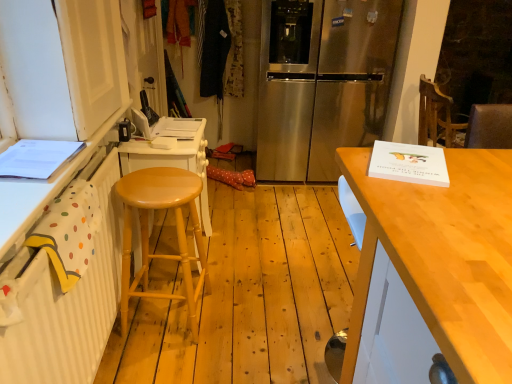
Question: Does light wood stool at left turn towards white painted wood cabinet at left?

Choices:
 (A) yes
 (B) no

Answer: (B)

Question: Would you say white painted wood cabinet at left is part of light wood stool at left's contents?

Choices:
 (A) yes
 (B) no

Answer: (B)

Question: Does light wood stool at left have a lesser height compared to white painted wood cabinet at left?

Choices:
 (A) no
 (B) yes

Answer: (A)

Question: Is the position of light wood stool at left less distant than that of white painted wood cabinet at left?

Choices:
 (A) no
 (B) yes

Answer: (A)

Question: Does light wood stool at left have a greater height compared to white painted wood cabinet at left?

Choices:
 (A) yes
 (B) no

Answer: (A)

Question: Is light wood stool at left bigger than white painted wood cabinet at left?

Choices:
 (A) yes
 (B) no

Answer: (A)

Question: Does light wood table at right contain stainless steel refrigerator at center?

Choices:
 (A) yes
 (B) no

Answer: (B)

Question: Considering the relative sizes of light wood table at right and stainless steel refrigerator at center in the image provided, is light wood table at right taller than stainless steel refrigerator at center?

Choices:
 (A) no
 (B) yes

Answer: (A)

Question: Is light wood table at right at the right side of stainless steel refrigerator at center?

Choices:
 (A) no
 (B) yes

Answer: (B)

Question: From the image's perspective, is light wood table at right beneath stainless steel refrigerator at center?

Choices:
 (A) no
 (B) yes

Answer: (B)

Question: Can you confirm if light wood table at right is shorter than stainless steel refrigerator at center?

Choices:
 (A) yes
 (B) no

Answer: (A)

Question: Is the depth of light wood table at right less than that of stainless steel refrigerator at center?

Choices:
 (A) no
 (B) yes

Answer: (B)

Question: Are stainless steel refrigerator at center and white painted wood cabinet at left beside each other?

Choices:
 (A) no
 (B) yes

Answer: (A)